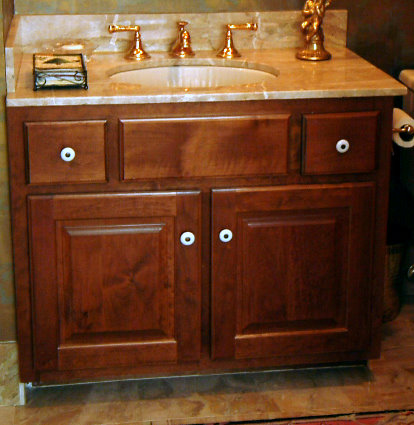
Find the location of a particular element. The image size is (414, 425). paper hand towel holder is located at coordinates click(33, 79).